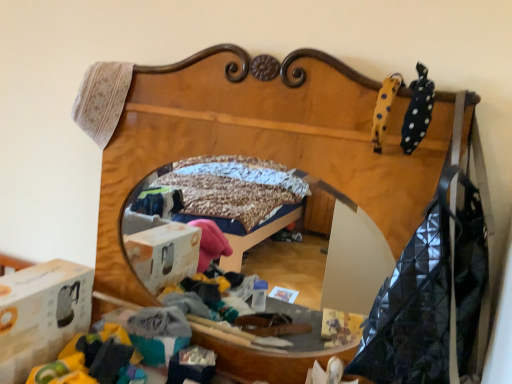
Question: Is white cardboard box at lower left placed right next to yellow dotted plush at upper right?

Choices:
 (A) yes
 (B) no

Answer: (B)

Question: Does white cardboard box at lower left turn towards yellow dotted plush at upper right?

Choices:
 (A) no
 (B) yes

Answer: (A)

Question: Is white cardboard box at lower left located outside yellow dotted plush at upper right?

Choices:
 (A) yes
 (B) no

Answer: (A)

Question: Does white cardboard box at lower left have a lesser height compared to yellow dotted plush at upper right?

Choices:
 (A) no
 (B) yes

Answer: (A)

Question: Does white cardboard box at lower left have a greater width compared to yellow dotted plush at upper right?

Choices:
 (A) yes
 (B) no

Answer: (A)

Question: From a real-world perspective, is white cardboard box at lower left physically below yellow dotted plush at upper right?

Choices:
 (A) no
 (B) yes

Answer: (B)

Question: Is yellow dotted plush at upper right not inside white cardboard box at lower left?

Choices:
 (A) yes
 (B) no

Answer: (A)

Question: Can you confirm if yellow dotted plush at upper right is shorter than white cardboard box at lower left?

Choices:
 (A) yes
 (B) no

Answer: (A)

Question: Considering the relative positions of yellow dotted plush at upper right and white cardboard box at lower left in the image provided, is yellow dotted plush at upper right in front of white cardboard box at lower left?

Choices:
 (A) yes
 (B) no

Answer: (A)

Question: From a real-world perspective, does yellow dotted plush at upper right sit lower than white cardboard box at lower left?

Choices:
 (A) yes
 (B) no

Answer: (B)

Question: Considering the relative sizes of yellow dotted plush at upper right and white cardboard box at lower left in the image provided, is yellow dotted plush at upper right wider than white cardboard box at lower left?

Choices:
 (A) no
 (B) yes

Answer: (A)

Question: Is yellow dotted plush at upper right further to camera compared to white cardboard box at lower left?

Choices:
 (A) no
 (B) yes

Answer: (A)

Question: Can you confirm if wooden bed frame at center is wider than yellow dotted plush at upper right?

Choices:
 (A) yes
 (B) no

Answer: (A)